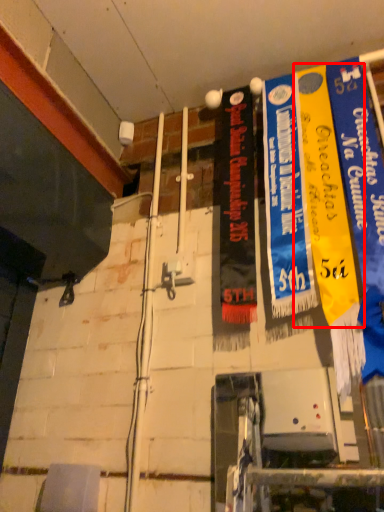
Question: Where is poster (annotated by the red box) located in relation to poster in the image?

Choices:
 (A) left
 (B) right

Answer: (B)